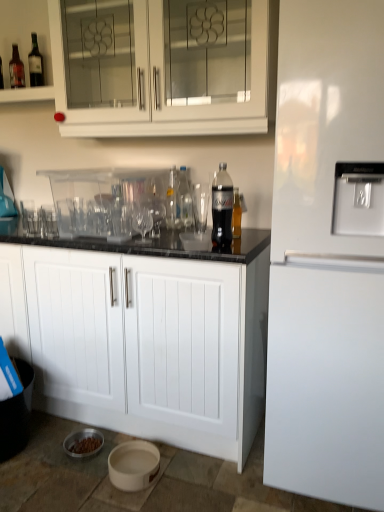
At what (x,y) coordinates should I click in order to perform the action: click on free space in front of clear glass wine glass at center, the second wine glass in the left-to-right sequence. Please return your answer as a coordinate pair (x, y). Looking at the image, I should click on click(x=145, y=244).